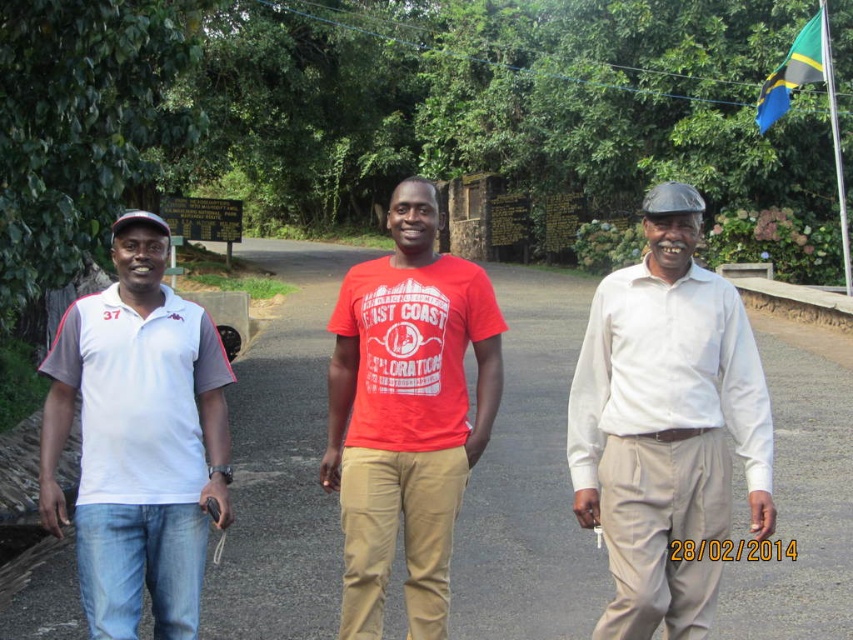
Question: Is khaki cotton pants at right to the left of matte khaki pants at center from the viewer's perspective?

Choices:
 (A) no
 (B) yes

Answer: (A)

Question: Is khaki cotton pants at right closer to camera compared to blue-green fabric flag at upper right?

Choices:
 (A) no
 (B) yes

Answer: (B)

Question: Which object is closer to the camera taking this photo?

Choices:
 (A) matte khaki pants at center
 (B) blue-green fabric flag at upper right

Answer: (A)

Question: Is khaki cotton pants at right below blue-green fabric flag at upper right?

Choices:
 (A) yes
 (B) no

Answer: (A)

Question: Which point appears closest to the camera in this image?

Choices:
 (A) (352, 387)
 (B) (653, 307)
 (C) (791, 44)
 (D) (177, 472)

Answer: (D)

Question: Which point is farther from the camera taking this photo?

Choices:
 (A) (699, 429)
 (B) (136, 300)
 (C) (769, 120)

Answer: (C)